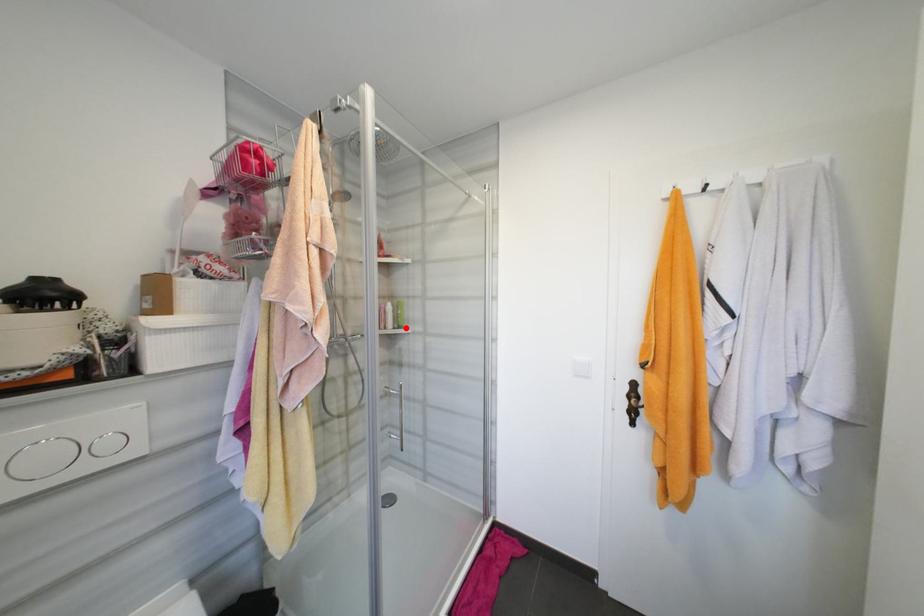
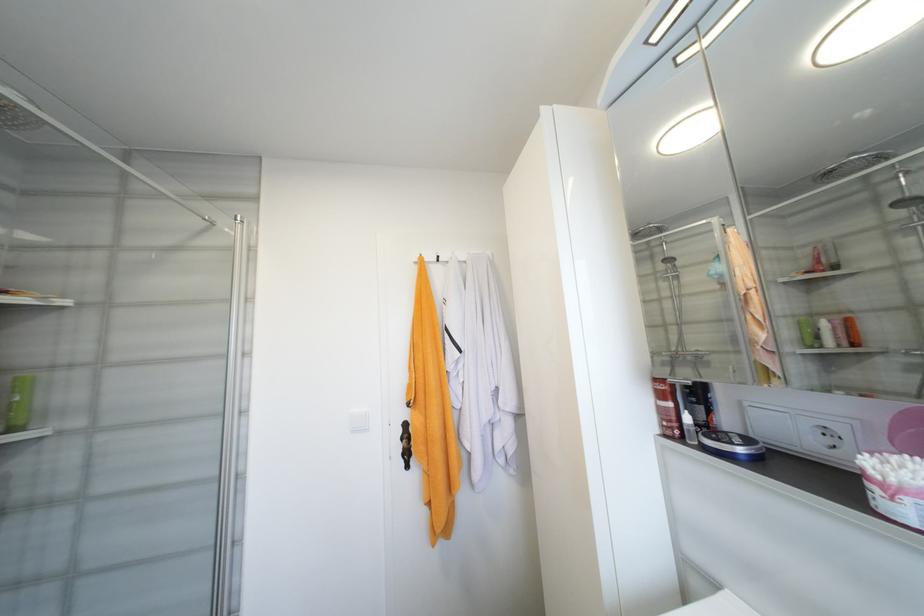
Locate, in the second image, the point that corresponds to the highlighted location in the first image.

(19, 430)